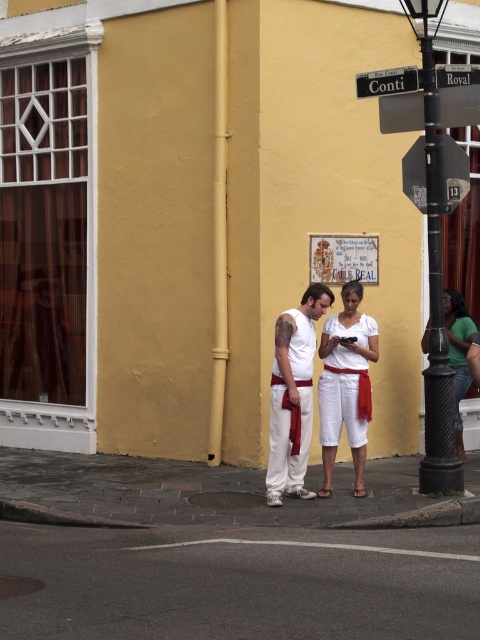
Question: Does white cotton dress at center have a larger size compared to metallic reflective sign at upper right?

Choices:
 (A) no
 (B) yes

Answer: (B)

Question: Is black textured pole at right below green cotton shirt at right?

Choices:
 (A) yes
 (B) no

Answer: (A)

Question: Can you confirm if black textured pole at right is smaller than black plastic street sign at upper center?

Choices:
 (A) yes
 (B) no

Answer: (B)

Question: Which point is farther to the camera?

Choices:
 (A) metallic street sign at upper center
 (B) green cotton shirt at right

Answer: (B)

Question: Which point appears farthest from the camera in this image?

Choices:
 (A) (455, 70)
 (B) (407, 92)
 (C) (272, 445)

Answer: (B)

Question: Which is nearer to the white cotton dress at center?

Choices:
 (A) black textured pole at right
 (B) white matte tank top at center
 (C) black plastic street sign at upper center

Answer: (B)